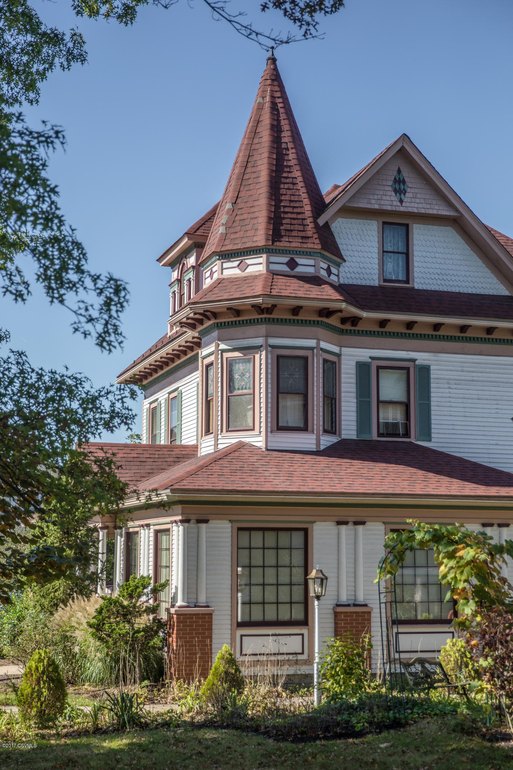
This screenshot has width=513, height=770. What are the coordinates of `third floor window` in the screenshot? It's located at (396, 236).